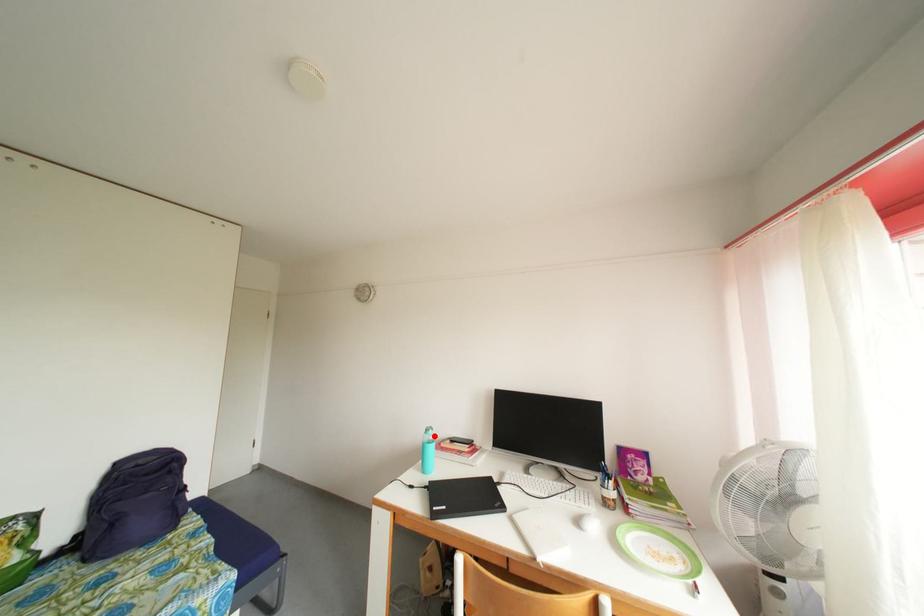
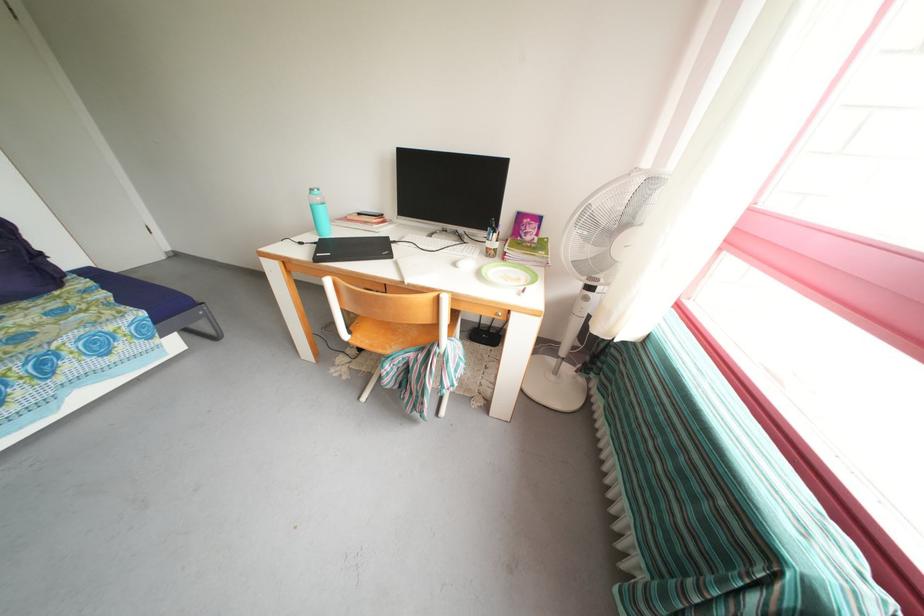
Find the pixel in the second image that matches the highlighted location in the first image.

(319, 196)